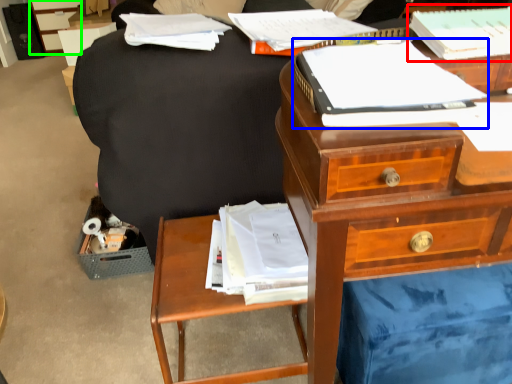
Question: Considering the real-world distances, which object is farthest from paperback book (highlighted by a red box)? paperback book (highlighted by a blue box) or file cabinet (highlighted by a green box)?

Choices:
 (A) paperback book
 (B) file cabinet

Answer: (B)